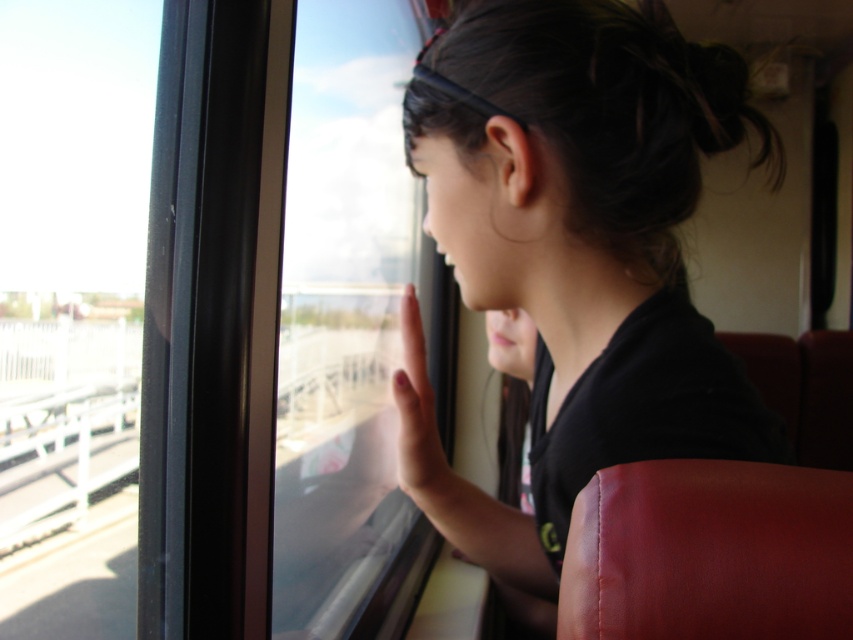
Question: Which object is farther from the camera taking this photo?

Choices:
 (A) transparent glass window at center
 (B) transparent glass train window at left
 (C) pink flesh at window
 (D) black matte hair at upper center

Answer: (B)

Question: Is black matte hair at upper center positioned before transparent glass train window at left?

Choices:
 (A) yes
 (B) no

Answer: (A)

Question: Which of the following is the closest to the observer?

Choices:
 (A) transparent glass train window at left
 (B) pink flesh at window
 (C) black matte hair at upper center

Answer: (C)

Question: Can you confirm if black matte hair at upper center is positioned to the right of pink flesh at window?

Choices:
 (A) no
 (B) yes

Answer: (B)

Question: Is black matte hair at upper center wider than pink flesh at window?

Choices:
 (A) no
 (B) yes

Answer: (B)

Question: Considering the real-world distances, which object is closest to the transparent glass train window at left?

Choices:
 (A) pink flesh at window
 (B) transparent glass window at center

Answer: (B)